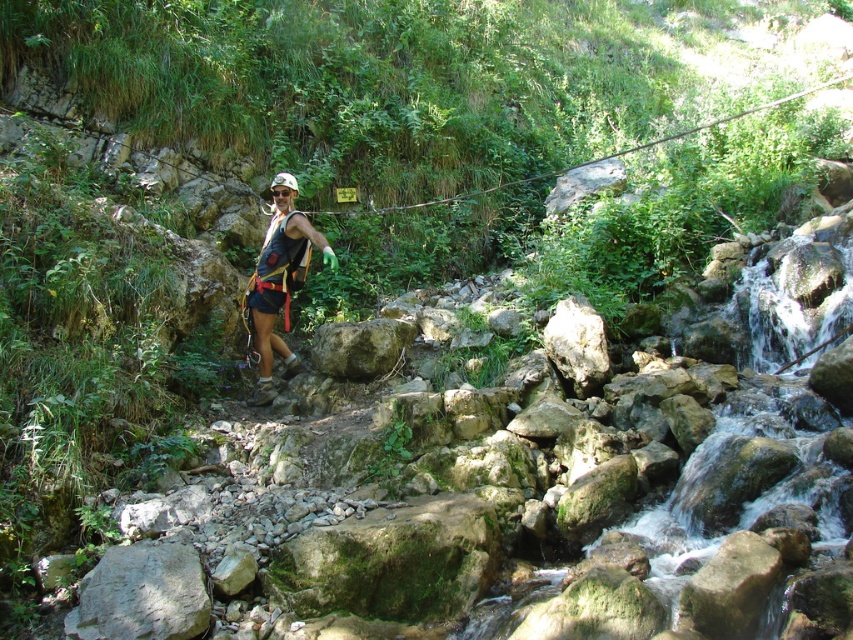
You are a hiker who needs to locate your gear in the image. Where exactly is the matte black vest at center located in the scene?

The matte black vest at center is located at point coordinates of (280,280).

You are a hiker planning to cross the rocky terrain in the image. You see the matte black vest at center and the green mossy rock at center. Which object is taller?

The matte black vest at center is taller than the green mossy rock at center according to the description.

You are an adventurer preparing to cross the rocky terrain. You notice the matte black vest at center and the green mossy rock at center. Which object is positioned to the left of the other?

The matte black vest at center is to the left of the green mossy rock at center.